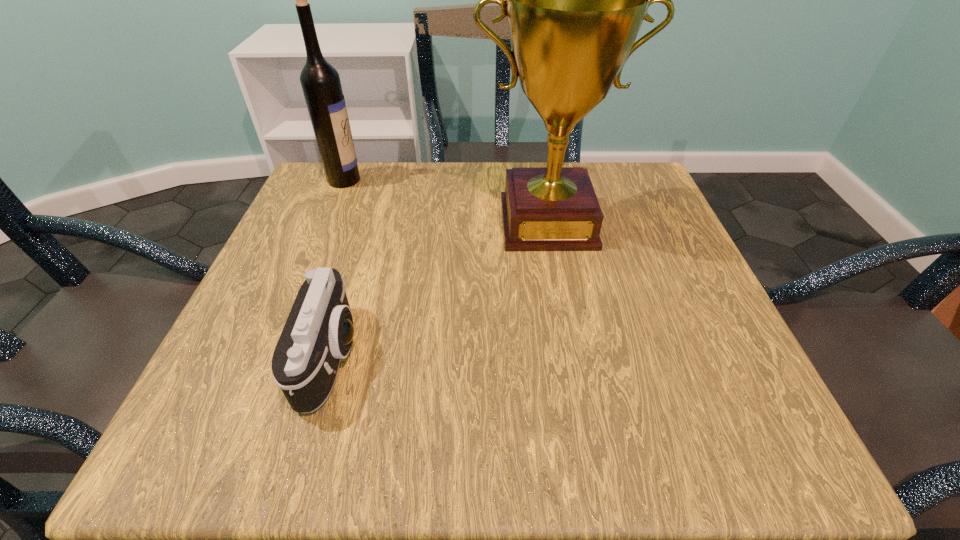
You are a GUI agent. You are given a task and a screenshot of the screen. Output one action in this format:
    pyautogui.click(x=<x>, y=<y>)
    Task: Click on the wine bottle positioned at the far edge
    The image size is (960, 540).
    Given the screenshot: What is the action you would take?
    320,81

The height and width of the screenshot is (540, 960). Identify the location of object present at the near edge. (318, 332).

Find the location of a particular element. This screenshot has height=540, width=960. wine bottle situated at the left edge is located at coordinates (320, 81).

Locate an element on the screen. camera located at the left edge is located at coordinates (318, 332).

Locate an element on the screen. The image size is (960, 540). object located in the right edge section of the desktop is located at coordinates (575, 0).

The height and width of the screenshot is (540, 960). Find the location of `object that is at the far left corner`. object that is at the far left corner is located at coordinates (320, 81).

I want to click on object present at the near left corner, so click(318, 332).

Locate an element on the screen. The width and height of the screenshot is (960, 540). object at the far right corner is located at coordinates (575, 0).

Locate an element on the screen. vacant space at the far edge of the desktop is located at coordinates (413, 164).

Locate an element on the screen. vacant space at the near edge of the desktop is located at coordinates (461, 403).